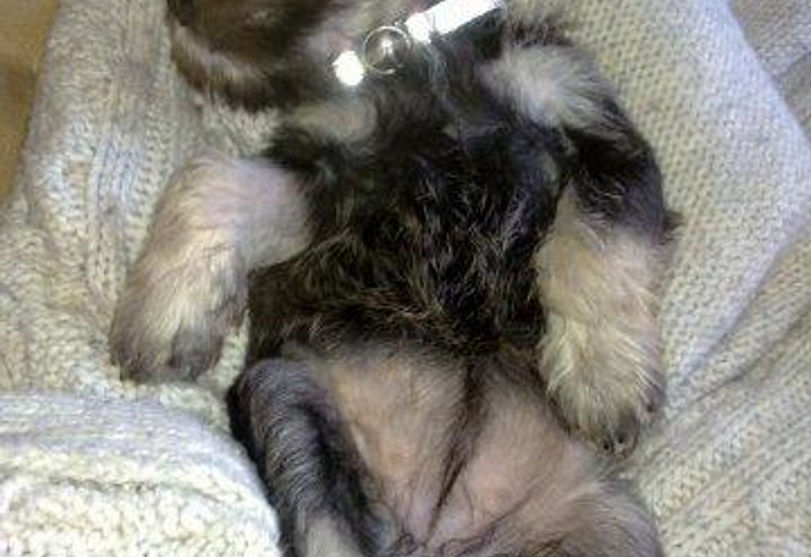
Identify the location of brown sheets. The image size is (811, 557). (14, 109).